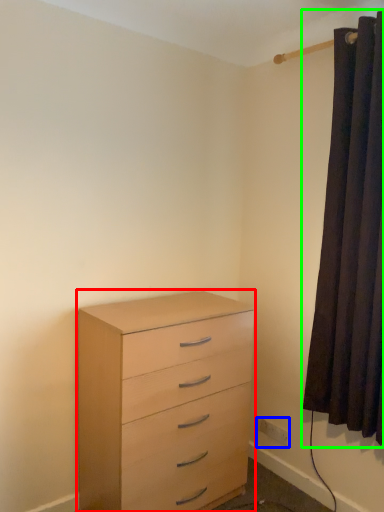
Question: Which object is positioned farthest from chest of drawers (highlighted by a red box)? Select from electric outlet (highlighted by a blue box) and curtain (highlighted by a green box).

Choices:
 (A) electric outlet
 (B) curtain

Answer: (A)